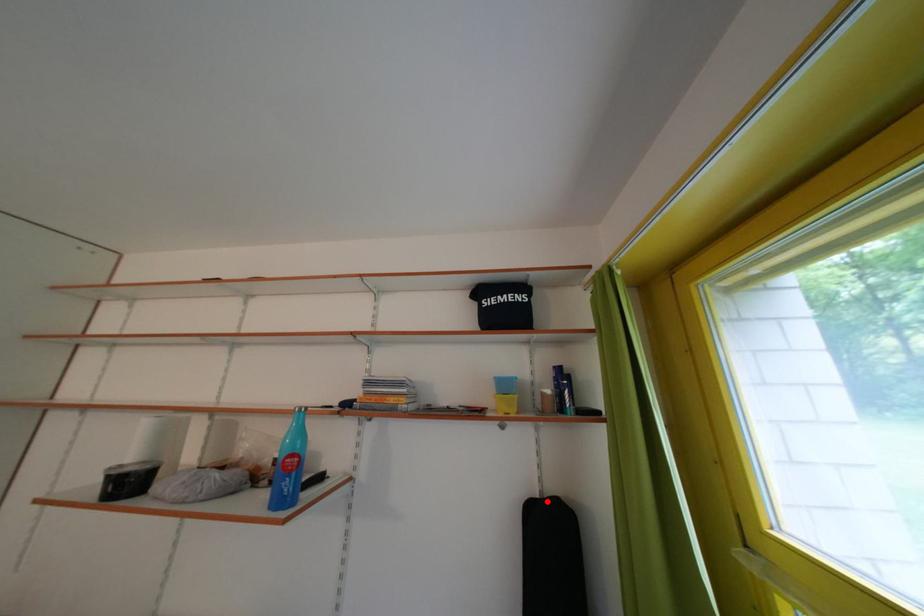
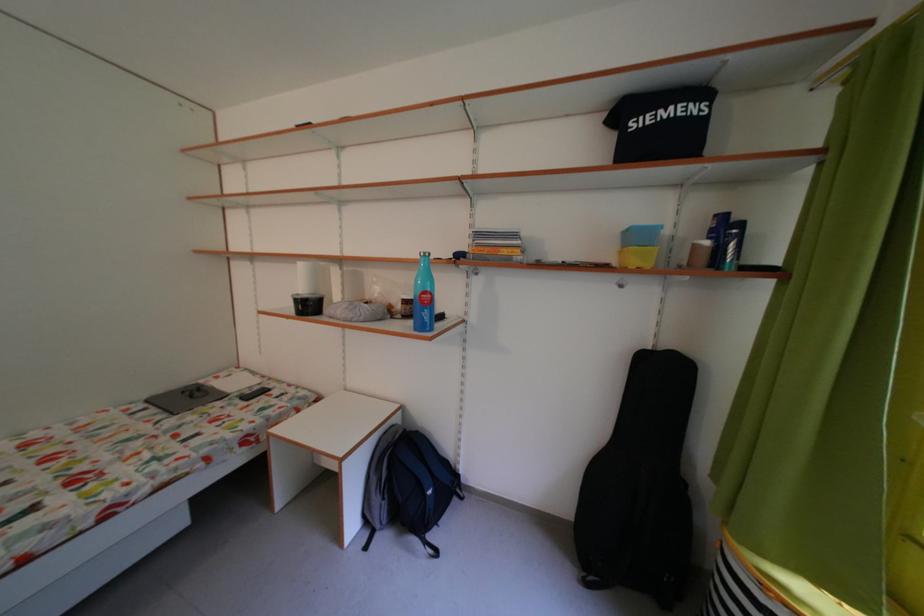
Locate, in the second image, the point that corresponds to the highlighted location in the first image.

(661, 354)